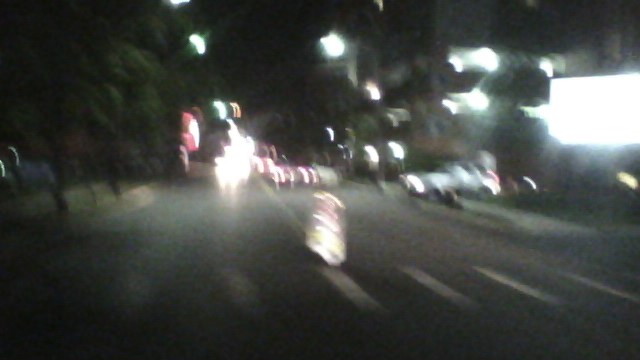
You are a GUI agent. You are given a task and a screenshot of the screen. Output one action in this format:
    pyautogui.click(x=<x>, y=<y>)
    Task: Click on the top right light
    This screenshot has height=360, width=640.
    Given the screenshot: What is the action you would take?
    pyautogui.click(x=338, y=45)